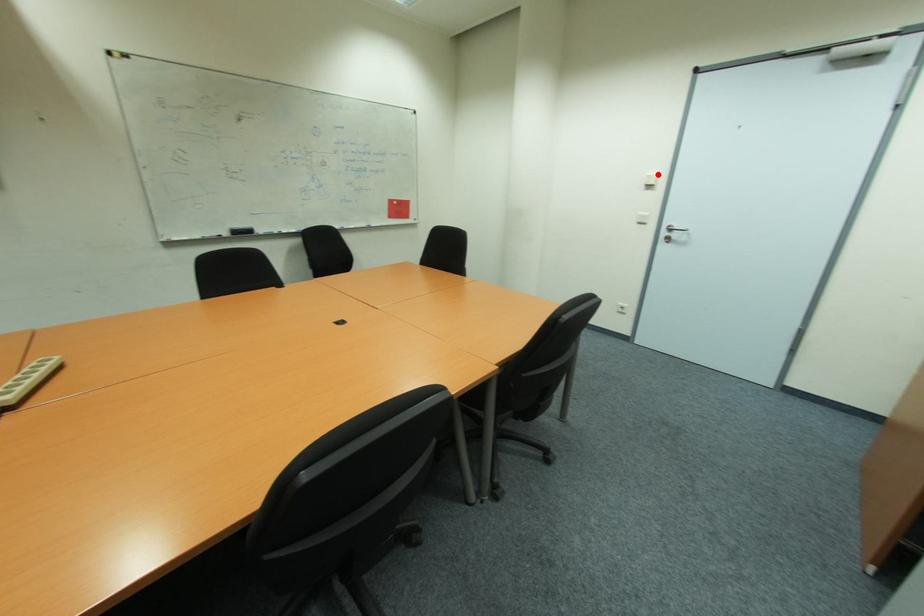
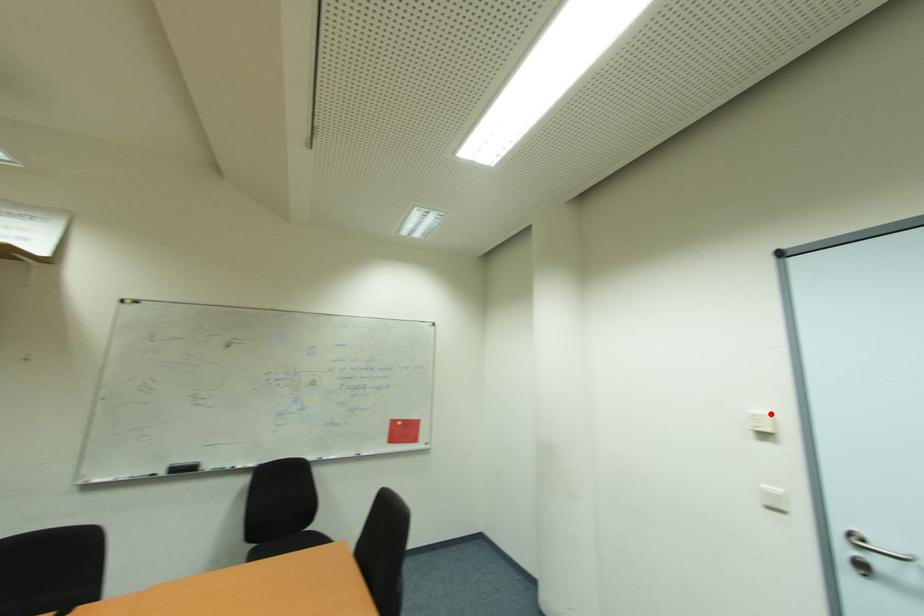
I am providing you with two images of the same scene from different viewpoints. A red point is marked on the first image and another point is marked on the second image. Do the highlighted points in image1 and image2 indicate the same real-world spot?

Yes